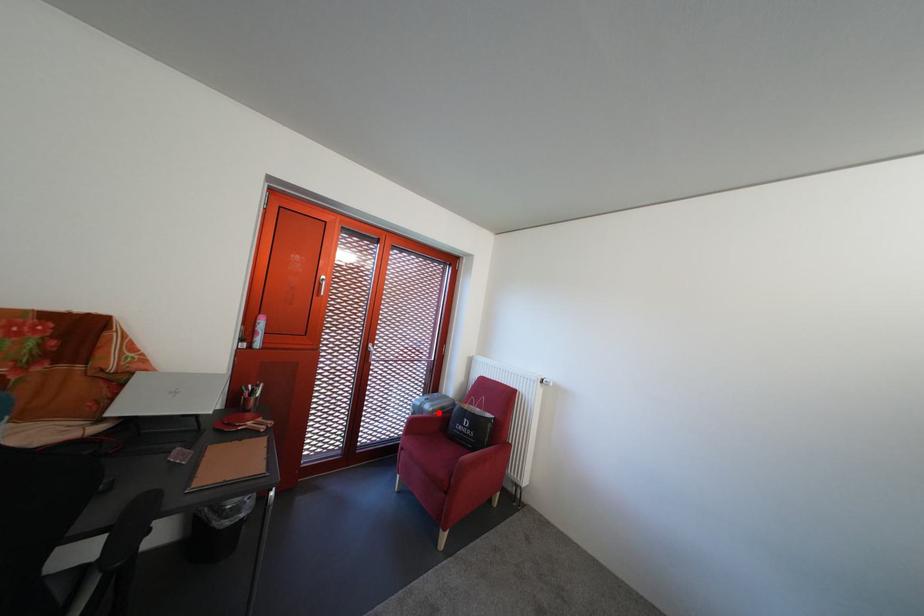
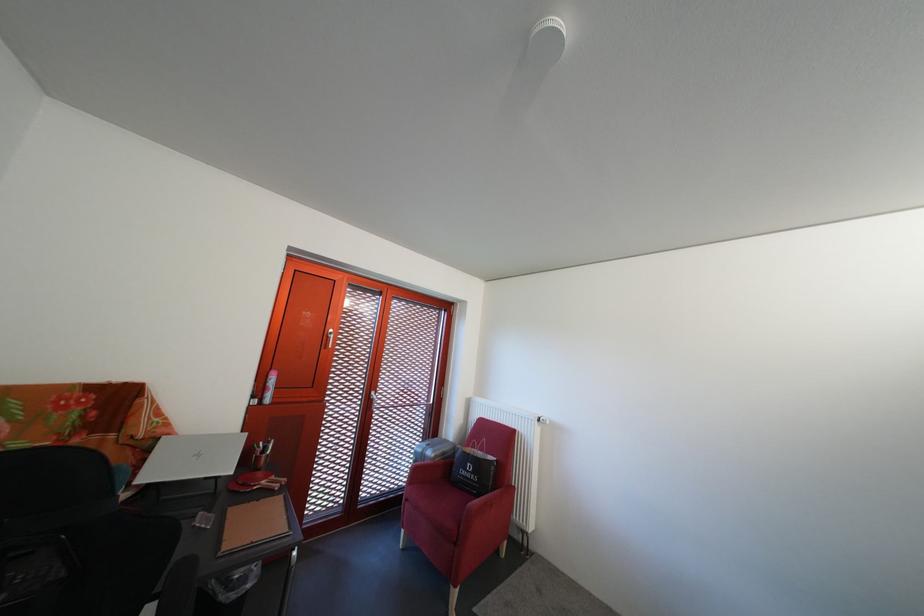
Question: I am providing you with two images of the same scene from different viewpoints. A red point is marked on the first image. Is the red point's position out of view in image 2?

Choices:
 (A) Yes
 (B) No

Answer: (B)